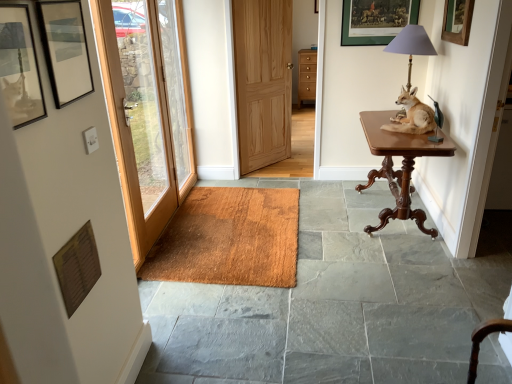
Where is `vacant space positioned to the left of mahogany wood table at right`? The image size is (512, 384). vacant space positioned to the left of mahogany wood table at right is located at coordinates (330, 219).